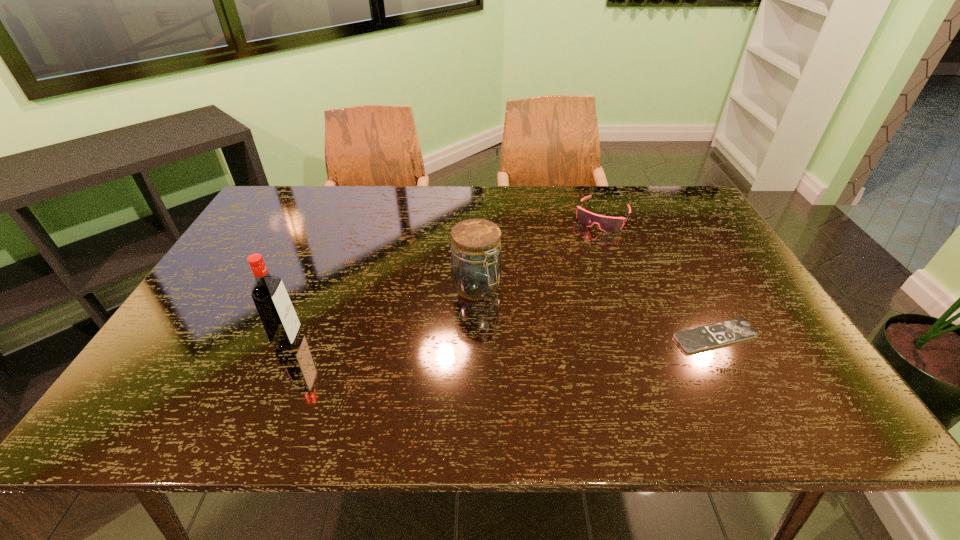
Locate an element on the screen. Image resolution: width=960 pixels, height=540 pixels. free space between the tallest object and the second shortest object is located at coordinates (444, 278).

At what (x,y) coordinates should I click in order to perform the action: click on free area in between the farthest object and the tallest object. Please return your answer as a coordinate pair (x, y). The width and height of the screenshot is (960, 540). Looking at the image, I should click on (444, 278).

Identify the location of free space between the remote control and the third nearest object. The width and height of the screenshot is (960, 540). (595, 312).

Where is `vacant space in between the shortest object and the vodka`? vacant space in between the shortest object and the vodka is located at coordinates (501, 338).

Find the location of `vacant region between the third object from right to left and the remote control`. vacant region between the third object from right to left and the remote control is located at coordinates pyautogui.click(x=595, y=312).

Locate an element on the screen. The image size is (960, 540). empty space between the leftmost object and the remote control is located at coordinates (501, 338).

Select which object appears as the closest to the third nearest object. Please provide its 2D coordinates. Your answer should be formatted as a tuple, i.e. [(x, y)], where the tuple contains the x and y coordinates of a point satisfying the conditions above.

[(607, 224)]

Locate which object is the third closest to the leftmost object. Please provide its 2D coordinates. Your answer should be formatted as a tuple, i.e. [(x, y)], where the tuple contains the x and y coordinates of a point satisfying the conditions above.

[(700, 338)]

Locate an element on the screen. free space in the image that satisfies the following two spatial constraints: 1. on the front side of the remote control; 2. on the right side of the second object from left to right is located at coordinates (476, 336).